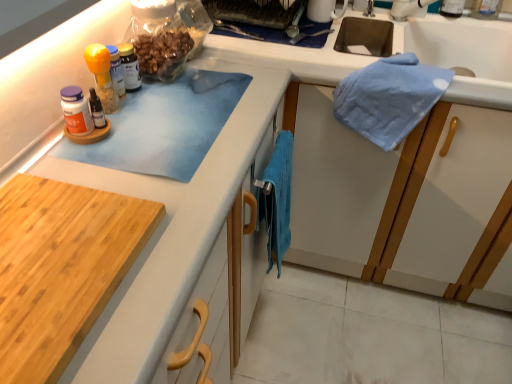
Where is `vacant region above wooden cutting board at lower left (from a real-world perspective)`? vacant region above wooden cutting board at lower left (from a real-world perspective) is located at coordinates (47, 255).